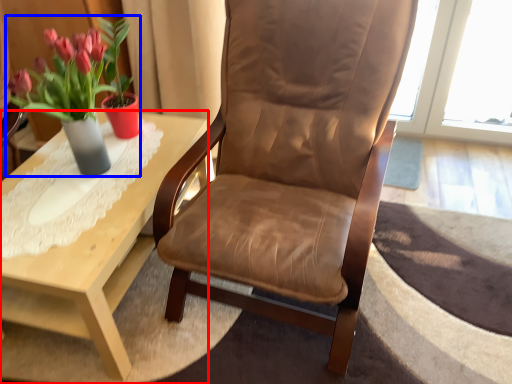
Question: Which object is closer to the camera taking this photo, coffee table (highlighted by a red box) or houseplant (highlighted by a blue box)?

Choices:
 (A) coffee table
 (B) houseplant

Answer: (B)